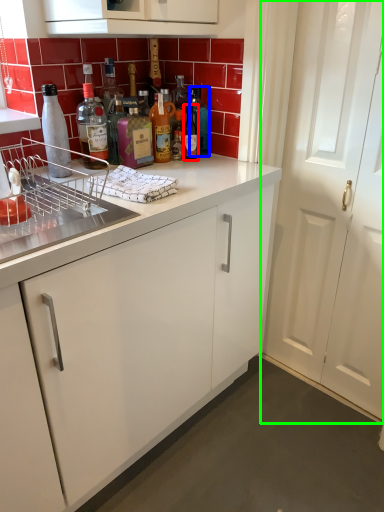
Question: Considering the real-world distances, which object is farthest from bottle (highlighted by a red box)? bottle (highlighted by a blue box) or door (highlighted by a green box)?

Choices:
 (A) bottle
 (B) door

Answer: (B)